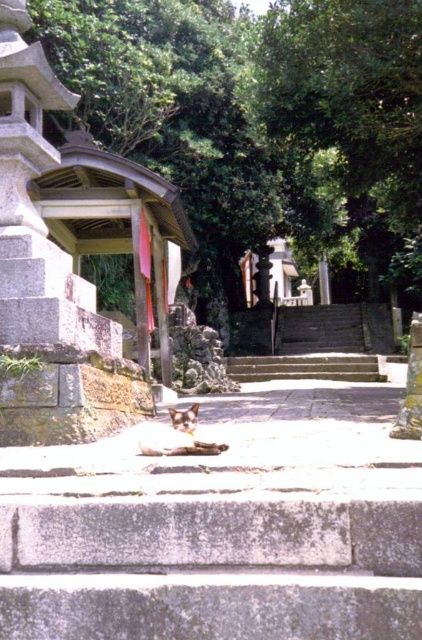
You are standing at point [302,365] and want to walk to point [384,378]. Which direction should you move?

You should move forward towards point [384,378] because point [302,365] is behind it.

You are standing at the entrance of the shrine and see the point marked at coordinates (311, 342). What does this point indicate in the scene?

The point at coordinates (311, 342) marks the location of the smooth concrete stairs at center.

You are a photographer planning to take a photo of the gray concrete stairs at center and the smooth concrete stairs at center in the scene. Which stairs should you focus on first if you want to capture the larger structure in your shot?

You should focus on the smooth concrete stairs at center first because it is larger in size than the gray concrete stairs at center, making it the more prominent feature to include in the photo.